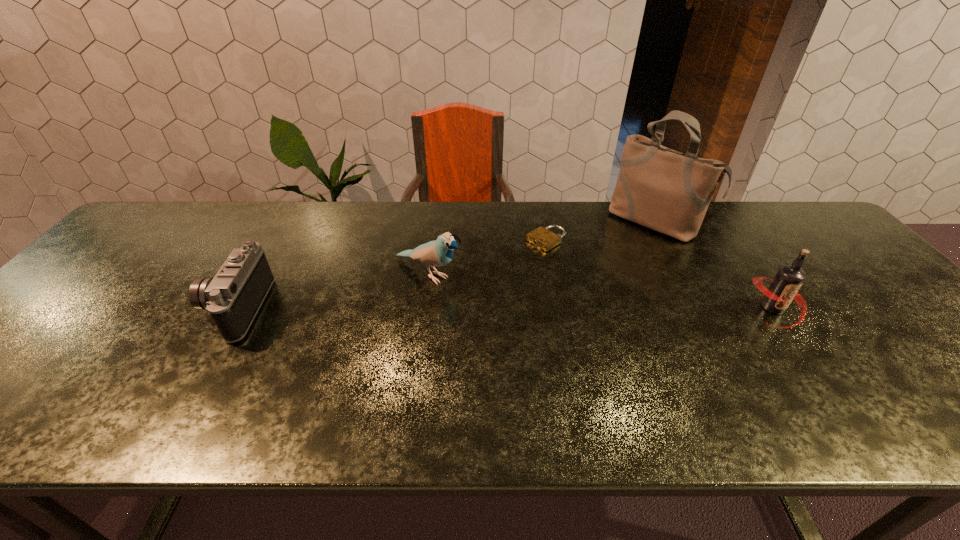
Find the location of a particular element. empty space that is in between the padlock and the shoulder bag is located at coordinates (600, 231).

Locate an element on the screen. This screenshot has width=960, height=540. unoccupied position between the shoulder bag and the root beer is located at coordinates tap(714, 265).

Find the location of a particular element. The height and width of the screenshot is (540, 960). vacant space in between the third object from right to left and the fourth tallest object is located at coordinates (391, 274).

Identify the location of free space that is in between the root beer and the leftmost object. This screenshot has height=540, width=960. (505, 308).

This screenshot has width=960, height=540. I want to click on free space between the bird and the shortest object, so click(488, 257).

Locate an element on the screen. vacant space that's between the shoulder bag and the root beer is located at coordinates (714, 265).

Find the location of a particular element. free area in between the shoulder bag and the root beer is located at coordinates (714, 265).

Where is `free space that is in between the camera and the shoulder bag`? free space that is in between the camera and the shoulder bag is located at coordinates (445, 265).

Where is `free space that is in between the tallest object and the root beer`? free space that is in between the tallest object and the root beer is located at coordinates (714, 265).

This screenshot has height=540, width=960. I want to click on object that is the second closest to the padlock, so [x=437, y=253].